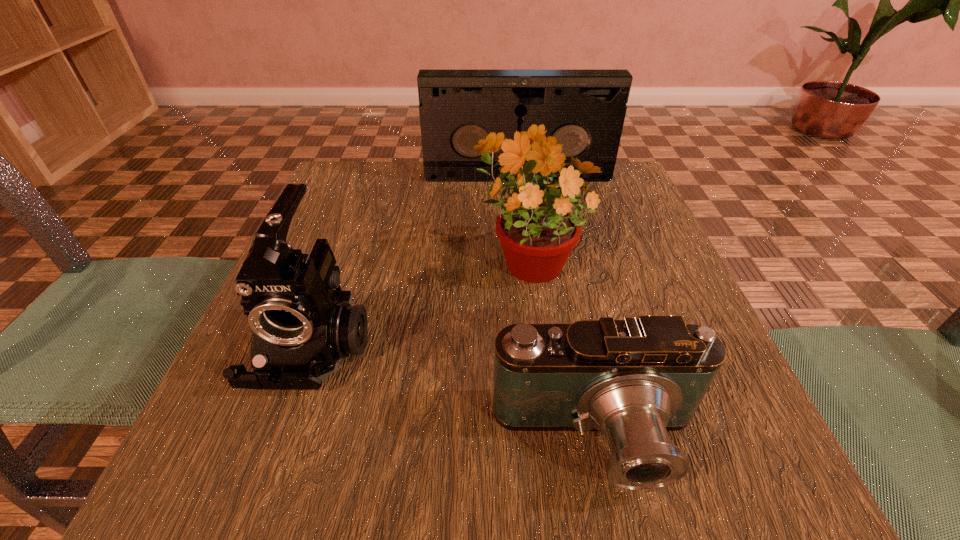
Where is `object that is at the near edge`? object that is at the near edge is located at coordinates (635, 379).

This screenshot has height=540, width=960. Find the location of `object positioned at the left edge`. object positioned at the left edge is located at coordinates (302, 329).

The height and width of the screenshot is (540, 960). I want to click on videotape present at the right edge, so click(588, 107).

You are a GUI agent. You are given a task and a screenshot of the screen. Output one action in this format:
    pyautogui.click(x=<x>, y=<y>)
    Task: Click on the camcorder that is at the right edge
    
    Given the screenshot: What is the action you would take?
    pyautogui.click(x=635, y=379)

The height and width of the screenshot is (540, 960). Identify the location of object positioned at the far right corner. pyautogui.click(x=588, y=107).

Find the location of `object present at the near right corner`. object present at the near right corner is located at coordinates (635, 379).

Identify the location of vacant point at the far edge. (407, 200).

The width and height of the screenshot is (960, 540). In the image, there is a desktop. Identify the location of vacant space at the near edge. (535, 468).

Locate an element on the screen. This screenshot has height=540, width=960. vacant space at the left edge of the desktop is located at coordinates (323, 225).

You are a GUI agent. You are given a task and a screenshot of the screen. Output one action in this format:
    pyautogui.click(x=<x>, y=<y>)
    Task: Click on the vacant space at the right edge
    This screenshot has width=960, height=540.
    Given the screenshot: What is the action you would take?
    697,428